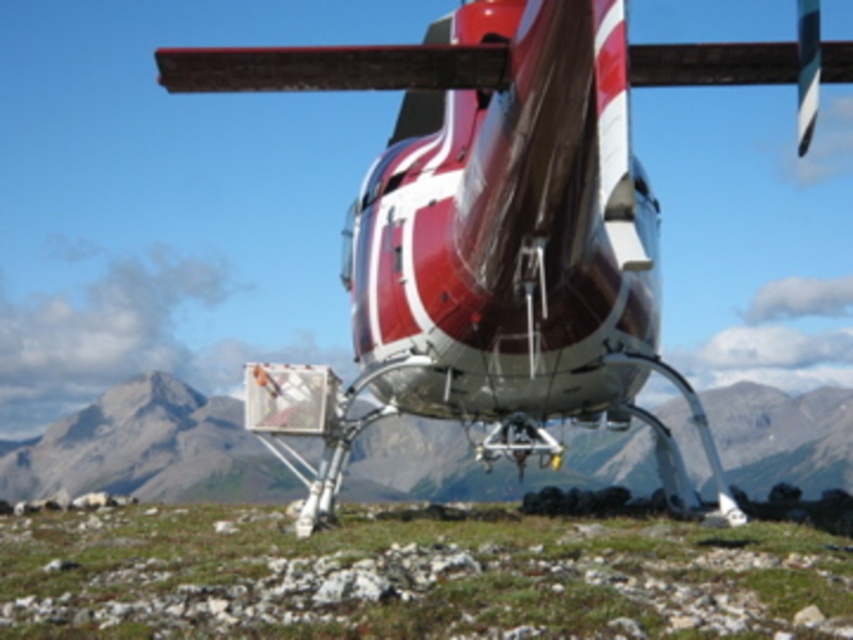
Who is positioned more to the left, green grass at center or matte gray rock at center?

Positioned to the left is matte gray rock at center.

Does green grass at center appear under matte gray rock at center?

Actually, green grass at center is above matte gray rock at center.

Who is more forward, (816, 636) or (790, 401)?

Point (816, 636)

The width and height of the screenshot is (853, 640). Find the location of `green grass at center`. green grass at center is located at coordinates (415, 577).

Between shiny metallic helicopter at center and matte gray rock at center, which one appears on the right side from the viewer's perspective?

Positioned to the right is shiny metallic helicopter at center.

Consider the image. Does shiny metallic helicopter at center have a greater width compared to matte gray rock at center?

Incorrect, shiny metallic helicopter at center's width does not surpass matte gray rock at center's.

The height and width of the screenshot is (640, 853). I want to click on shiny metallic helicopter at center, so coord(500,227).

This screenshot has height=640, width=853. Find the location of `shiny metallic helicopter at center`. shiny metallic helicopter at center is located at coordinates (500, 227).

Between point (338, 61) and point (592, 609), which one is positioned behind?

Point (338, 61)

Between shiny metallic helicopter at center and green grass at center, which one appears on the right side from the viewer's perspective?

Positioned to the right is green grass at center.

Locate an element on the screen. shiny metallic helicopter at center is located at coordinates click(x=500, y=227).

Find the location of `shiny metallic helicopter at center`. shiny metallic helicopter at center is located at coordinates pyautogui.click(x=500, y=227).